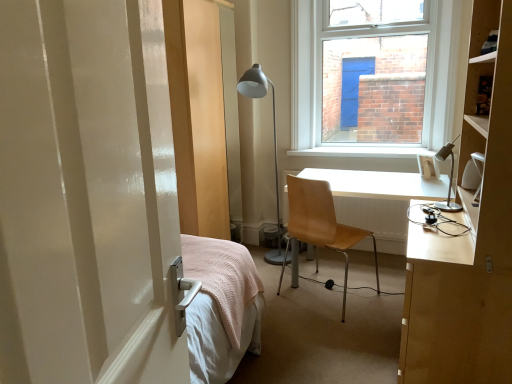
The width and height of the screenshot is (512, 384). I want to click on free space in front of light brown wood chair at center, so coord(339,338).